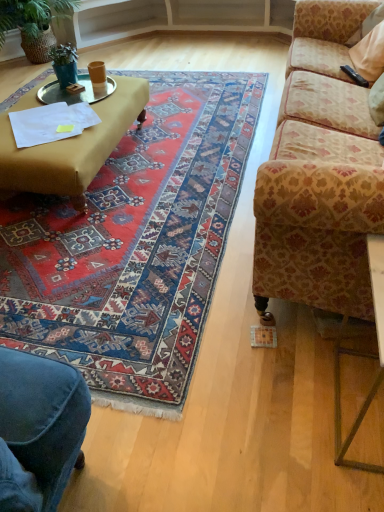
This screenshot has width=384, height=512. Find the location of `vacant position to the left of green matte plant at upper left, acting as the second houseplant starting from the back`. vacant position to the left of green matte plant at upper left, acting as the second houseplant starting from the back is located at coordinates (33, 88).